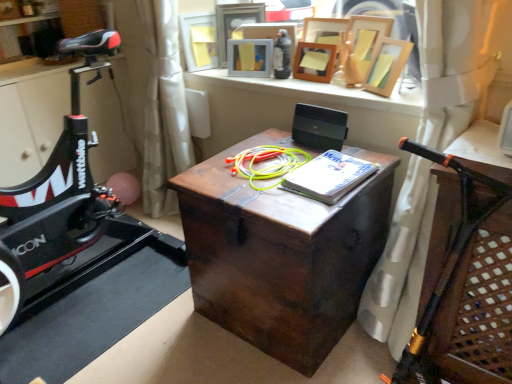
This screenshot has height=384, width=512. What are the coordinates of `free space to the left of dark wood trunk at center` in the screenshot? It's located at (151, 312).